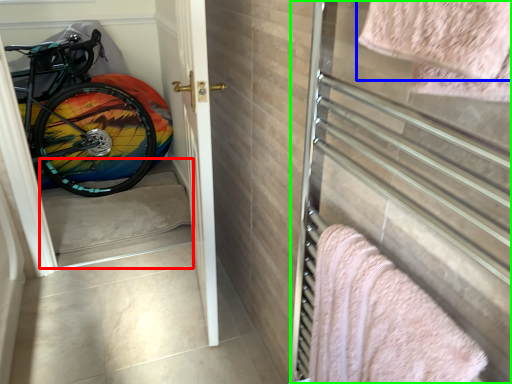
Question: Which is farther away from stairwell (highlighted by a red box)? towel (highlighted by a blue box) or screen door (highlighted by a green box)?

Choices:
 (A) towel
 (B) screen door

Answer: (A)